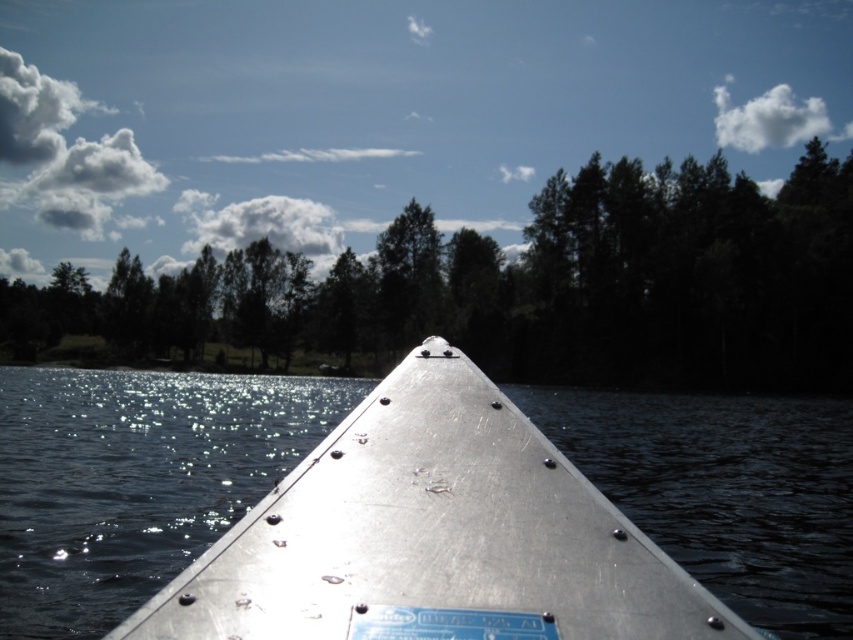
Looking at this image, which is more to the right, green matte tree at upper center or metallic boat at center?

From the viewer's perspective, metallic boat at center appears more on the right side.

The width and height of the screenshot is (853, 640). Identify the location of green matte tree at upper center. (523, 288).

The height and width of the screenshot is (640, 853). Identify the location of green matte tree at upper center. (523, 288).